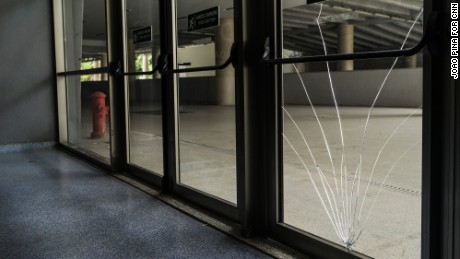
The height and width of the screenshot is (259, 460). I want to click on glass, so point(91,23), point(92,121), point(140,119), point(213,106), point(355,115).